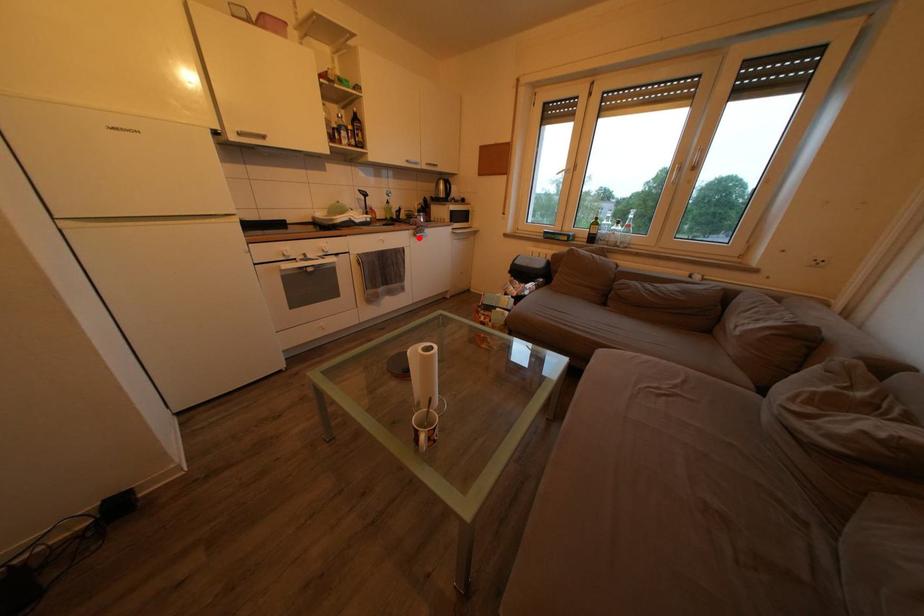
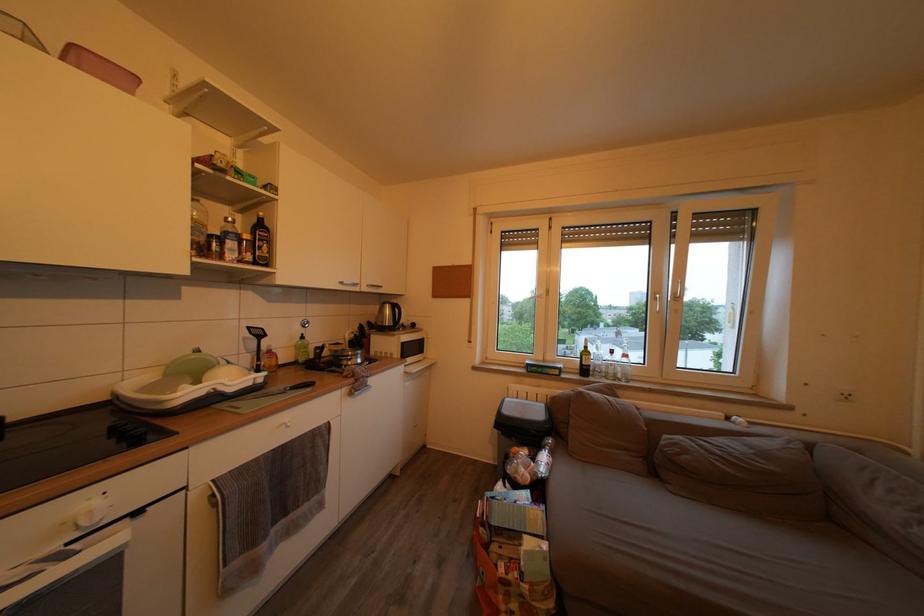
Question: A red point is marked in image1. In image2, is the corresponding 3D point closer to the camera or farther? Reply with the corresponding letter.

Choices:
 (A) The corresponding 3D point is closer.
 (B) The corresponding 3D point is farther.

Answer: (B)